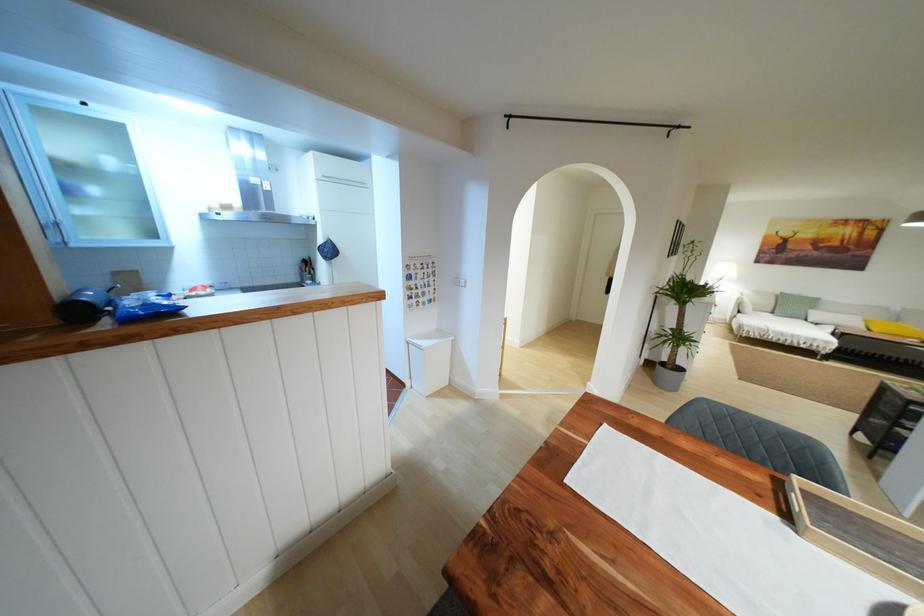
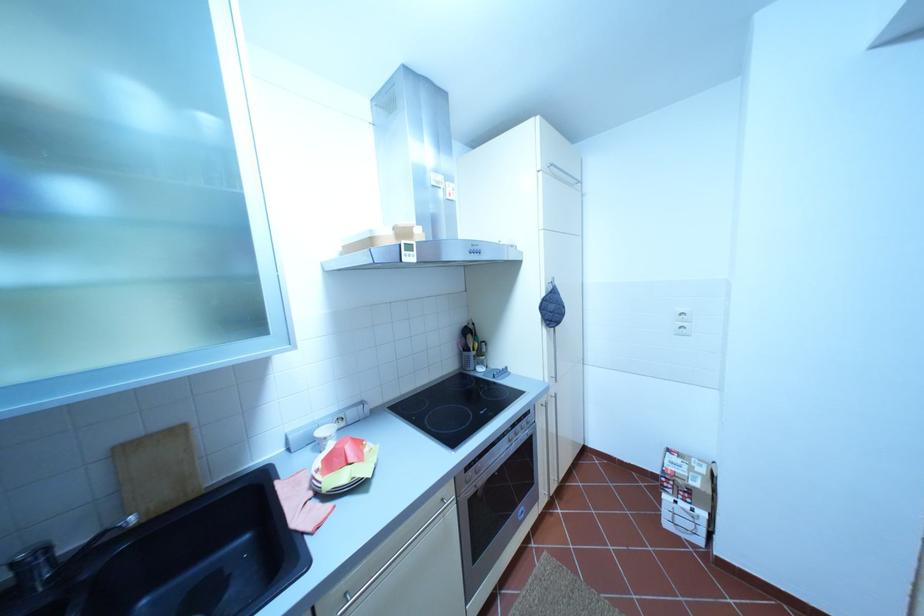
In a continuous first-person perspective shot, in which direction is the camera moving?

The movement direction of the cameraman is left, forward.